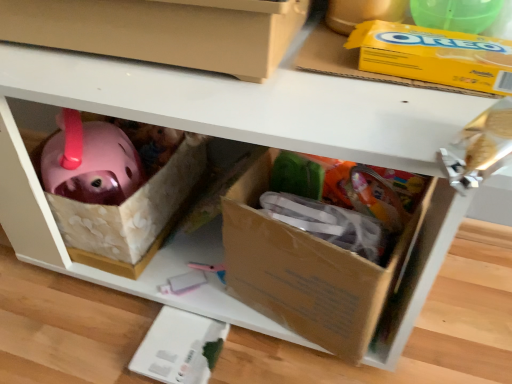
What are the coordinates of `matte cardboard box at center, which ranks as the 2th box in bottom-to-top order` in the screenshot? It's located at (163, 30).

The image size is (512, 384). Find the location of `cardboard box at lower right, the first box from the bottom`. cardboard box at lower right, the first box from the bottom is located at coordinates (309, 270).

Is matte cardboard box at center, arranged as the first box when viewed from the top, oriented towards cardboard box at lower right, the second box when ordered from top to bottom?

No, matte cardboard box at center, arranged as the first box when viewed from the top, is not aimed at cardboard box at lower right, the second box when ordered from top to bottom.

Is matte cardboard box at center, which ranks as the 2th box in bottom-to-top order, bigger or smaller than cardboard box at lower right, the second box when ordered from top to bottom?

In the image, matte cardboard box at center, which ranks as the 2th box in bottom-to-top order, appears to be larger than cardboard box at lower right, the second box when ordered from top to bottom.

Considering the relative positions of matte cardboard box at center, which ranks as the 2th box in bottom-to-top order, and cardboard box at lower right, the first box from the bottom, in the image provided, is matte cardboard box at center, which ranks as the 2th box in bottom-to-top order, in front of cardboard box at lower right, the first box from the bottom,?

Yes, the depth of matte cardboard box at center, which ranks as the 2th box in bottom-to-top order, is less than that of cardboard box at lower right, the first box from the bottom.

There is a cardboard box at lower right, the first box from the bottom. Where is `box above it (from a real-world perspective)`? The width and height of the screenshot is (512, 384). box above it (from a real-world perspective) is located at coordinates (163, 30).

Find the location of a particular element. The height and width of the screenshot is (384, 512). storage box behind the matte cardboard box at center, which ranks as the 2th box in bottom-to-top order is located at coordinates (434, 56).

Based on the photo, between yellow cardboard box at upper right and matte cardboard box at center, arranged as the first box when viewed from the top, which one appears on the right side from the viewer's perspective?

From the viewer's perspective, yellow cardboard box at upper right appears more on the right side.

Between yellow cardboard box at upper right and matte cardboard box at center, arranged as the first box when viewed from the top, which one has smaller size?

With smaller size is yellow cardboard box at upper right.

Between yellow cardboard box at upper right and matte cardboard box at center, which ranks as the 2th box in bottom-to-top order, which one has smaller width?

With smaller width is yellow cardboard box at upper right.

Is cardboard box at lower right, the second box when ordered from top to bottom, oriented towards matte cardboard box at center, arranged as the first box when viewed from the top?

No, cardboard box at lower right, the second box when ordered from top to bottom, does not turn towards matte cardboard box at center, arranged as the first box when viewed from the top.

Which object is positioned more to the left, cardboard box at lower right, the second box when ordered from top to bottom, or matte cardboard box at center, which ranks as the 2th box in bottom-to-top order?

matte cardboard box at center, which ranks as the 2th box in bottom-to-top order.

You are a GUI agent. You are given a task and a screenshot of the screen. Output one action in this format:
    pyautogui.click(x=<x>, y=<y>)
    Task: Click on the box located below the matte cardboard box at center, arranged as the first box when viewed from the top (from the image's perspective)
    The height and width of the screenshot is (384, 512).
    Given the screenshot: What is the action you would take?
    pyautogui.click(x=309, y=270)

Between cardboard box at lower right, the second box when ordered from top to bottom, and matte cardboard box at center, which ranks as the 2th box in bottom-to-top order, which one has larger size?

Bigger between the two is matte cardboard box at center, which ranks as the 2th box in bottom-to-top order.

Which of these two, cardboard box at lower right, the first box from the bottom, or yellow cardboard box at upper right, stands shorter?

With less height is yellow cardboard box at upper right.

From the image's perspective, does cardboard box at lower right, the second box when ordered from top to bottom, appear lower than yellow cardboard box at upper right?

Indeed, from the image's perspective, cardboard box at lower right, the second box when ordered from top to bottom, is shown beneath yellow cardboard box at upper right.

Based on their positions, is cardboard box at lower right, the first box from the bottom, located to the left or right of yellow cardboard box at upper right?

Clearly, cardboard box at lower right, the first box from the bottom, is on the left of yellow cardboard box at upper right in the image.

Based on the photo, is cardboard box at lower right, the second box when ordered from top to bottom, thinner than yellow cardboard box at upper right?

In fact, cardboard box at lower right, the second box when ordered from top to bottom, might be wider than yellow cardboard box at upper right.

Between point (493, 74) and point (286, 269), which one is positioned behind?

The point (286, 269) is farther from the camera.

Is yellow cardboard box at upper right completely or partially outside of cardboard box at lower right, the first box from the bottom?

Yes, yellow cardboard box at upper right is outside of cardboard box at lower right, the first box from the bottom.

Relative to cardboard box at lower right, the first box from the bottom, is yellow cardboard box at upper right in front or behind?

Visually, yellow cardboard box at upper right is located in front of cardboard box at lower right, the first box from the bottom.

Locate an element on the screen. The height and width of the screenshot is (384, 512). storage box positioned vertically above the cardboard box at lower right, the second box when ordered from top to bottom (from a real-world perspective) is located at coordinates (434, 56).

Does point (205, 60) come in front of point (366, 30)?

Yes, it is in front of point (366, 30).

You are a GUI agent. You are given a task and a screenshot of the screen. Output one action in this format:
    pyautogui.click(x=<x>, y=<y>)
    Task: Click on the storage box below the matte cardboard box at center, arranged as the first box when viewed from the top (from the image's perspective)
    Image resolution: width=512 pixels, height=384 pixels.
    Given the screenshot: What is the action you would take?
    pyautogui.click(x=434, y=56)

Based on the photo, from the image's perspective, would you say matte cardboard box at center, arranged as the first box when viewed from the top, is positioned over yellow cardboard box at upper right?

Yes, from the image's perspective, matte cardboard box at center, arranged as the first box when viewed from the top, is above yellow cardboard box at upper right.

Is yellow cardboard box at upper right completely or partially inside matte cardboard box at center, arranged as the first box when viewed from the top?

Actually, yellow cardboard box at upper right is outside matte cardboard box at center, arranged as the first box when viewed from the top.

This screenshot has height=384, width=512. In order to click on box below the matte cardboard box at center, which ranks as the 2th box in bottom-to-top order (from the image's perspective) in this screenshot , I will do `click(309, 270)`.

In the image, there is a matte cardboard box at center, which ranks as the 2th box in bottom-to-top order. Identify the location of storage box below it (from a real-world perspective). (434, 56).

From the image, which object appears to be nearer to matte cardboard box at center, arranged as the first box when viewed from the top, yellow cardboard box at upper right or cardboard box at lower right, the first box from the bottom?

yellow cardboard box at upper right lies closer to matte cardboard box at center, arranged as the first box when viewed from the top, than the other object.

Considering their positions, is matte cardboard box at center, arranged as the first box when viewed from the top, positioned closer to yellow cardboard box at upper right than cardboard box at lower right, the first box from the bottom?

matte cardboard box at center, arranged as the first box when viewed from the top, is closer to yellow cardboard box at upper right.

From the picture: Looking at the image, which one is located further to matte cardboard box at center, which ranks as the 2th box in bottom-to-top order, cardboard box at lower right, the second box when ordered from top to bottom, or yellow cardboard box at upper right?

cardboard box at lower right, the second box when ordered from top to bottom, is further to matte cardboard box at center, which ranks as the 2th box in bottom-to-top order.

Considering their positions, is yellow cardboard box at upper right positioned further to cardboard box at lower right, the second box when ordered from top to bottom, than matte cardboard box at center, which ranks as the 2th box in bottom-to-top order?

matte cardboard box at center, which ranks as the 2th box in bottom-to-top order.

Based on their spatial positions, is cardboard box at lower right, the first box from the bottom, or matte cardboard box at center, arranged as the first box when viewed from the top, further from yellow cardboard box at upper right?

cardboard box at lower right, the first box from the bottom, is positioned further to the anchor yellow cardboard box at upper right.

Considering their positions, is matte cardboard box at center, which ranks as the 2th box in bottom-to-top order, positioned further to cardboard box at lower right, the second box when ordered from top to bottom, than yellow cardboard box at upper right?

Among the two, matte cardboard box at center, which ranks as the 2th box in bottom-to-top order, is located further to cardboard box at lower right, the second box when ordered from top to bottom.

Where is `storage box between matte cardboard box at center, which ranks as the 2th box in bottom-to-top order, and cardboard box at lower right, the first box from the bottom, in the up-down direction`? Image resolution: width=512 pixels, height=384 pixels. storage box between matte cardboard box at center, which ranks as the 2th box in bottom-to-top order, and cardboard box at lower right, the first box from the bottom, in the up-down direction is located at coordinates (434, 56).